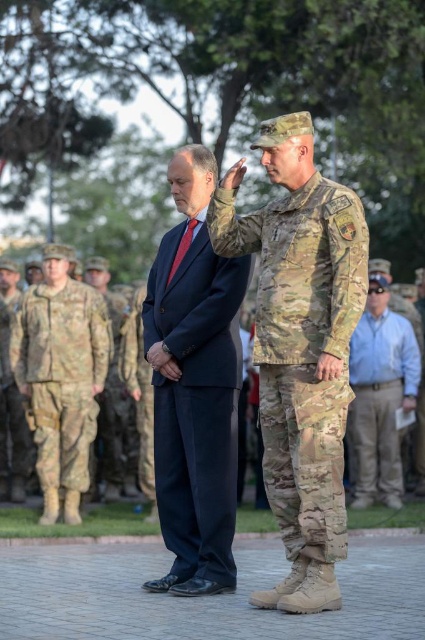
Does navy blue suit at center come behind camouflage uniform at center?

No.

Between navy blue suit at center and camouflage uniform at center, which one is positioned higher?

navy blue suit at center is above.

What do you see at coordinates (195, 385) in the screenshot? This screenshot has height=640, width=425. I see `navy blue suit at center` at bounding box center [195, 385].

Where is `navy blue suit at center`? The width and height of the screenshot is (425, 640). navy blue suit at center is located at coordinates (195, 385).

Is camouflage fabric pants at center to the right of blue shirt at center from the viewer's perspective?

In fact, camouflage fabric pants at center is to the left of blue shirt at center.

Is camouflage fabric pants at center smaller than blue shirt at center?

Yes.

Locate an element on the screen. The height and width of the screenshot is (640, 425). camouflage fabric pants at center is located at coordinates (62, 374).

Is camo fabric uniform at right wider than blue shirt at center?

Yes.

Between camo fabric uniform at right and blue shirt at center, which one appears on the right side from the viewer's perspective?

blue shirt at center is more to the right.

This screenshot has width=425, height=640. Identify the location of camo fabric uniform at right. (302, 348).